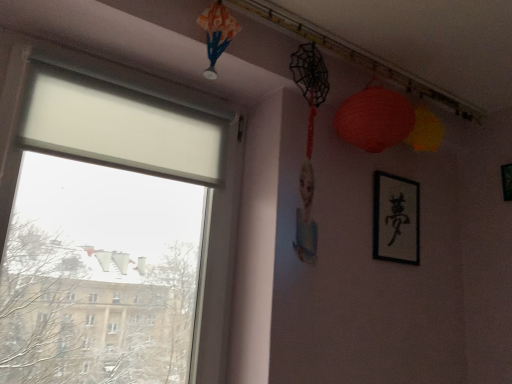
Image resolution: width=512 pixels, height=384 pixels. What do you see at coordinates (506, 181) in the screenshot? I see `black matte picture frame at upper right, the 2th picture frame in the left-to-right sequence` at bounding box center [506, 181].

At what (x,y) coordinates should I click in order to perform the action: click on black matte picture frame at upper right, the 2th picture frame in the left-to-right sequence. Please return your answer as a coordinate pair (x, y). Looking at the image, I should click on (506, 181).

What do you see at coordinates (396, 218) in the screenshot?
I see `black paper at upper right, which is counted as the second picture frame, starting from the right` at bounding box center [396, 218].

This screenshot has height=384, width=512. Find the location of `matte paper lantern at upper right`. matte paper lantern at upper right is located at coordinates (374, 119).

Is black matte picture frame at upper right, the 2th picture frame in the left-to-right sequence, positioned before black paper at upper right, which is counted as the second picture frame, starting from the right?

No, it is behind black paper at upper right, which is counted as the second picture frame, starting from the right.

Considering the sizes of objects black matte picture frame at upper right, the 1th picture frame when ordered from right to left, and black paper at upper right, the first picture frame when ordered from left to right, in the image provided, who is wider, black matte picture frame at upper right, the 1th picture frame when ordered from right to left, or black paper at upper right, the first picture frame when ordered from left to right,?

black paper at upper right, the first picture frame when ordered from left to right.

Is black matte picture frame at upper right, the 1th picture frame when ordered from right to left, shorter than black paper at upper right, which is counted as the second picture frame, starting from the right?

Correct, black matte picture frame at upper right, the 1th picture frame when ordered from right to left, is not as tall as black paper at upper right, which is counted as the second picture frame, starting from the right.

Considering the positions of point (374, 102) and point (397, 215), is point (374, 102) closer or farther from the camera than point (397, 215)?

Point (374, 102) is closer to the camera than point (397, 215).

Which object is closer to the camera, matte paper lantern at upper right or black paper at upper right, the first picture frame when ordered from left to right?

matte paper lantern at upper right is closer to the camera.

From the picture: Is matte paper lantern at upper right beside black paper at upper right, the first picture frame when ordered from left to right?

matte paper lantern at upper right and black paper at upper right, the first picture frame when ordered from left to right, are clearly separated.

Is matte paper lantern at upper right positioned with its back to black paper at upper right, the first picture frame when ordered from left to right?

That's not correct — matte paper lantern at upper right is not looking away from black paper at upper right, the first picture frame when ordered from left to right.

From a real-world perspective, which is physically above, black matte picture frame at upper right, the 2th picture frame in the left-to-right sequence, or matte paper lantern at upper right?

matte paper lantern at upper right is physically above.

Does black matte picture frame at upper right, the 2th picture frame in the left-to-right sequence, have a smaller size compared to matte paper lantern at upper right?

Correct, black matte picture frame at upper right, the 2th picture frame in the left-to-right sequence, occupies less space than matte paper lantern at upper right.

Is black matte picture frame at upper right, the 2th picture frame in the left-to-right sequence, wider or thinner than matte paper lantern at upper right?

Considering their sizes, black matte picture frame at upper right, the 2th picture frame in the left-to-right sequence, looks slimmer than matte paper lantern at upper right.

Consider the image. Are black matte picture frame at upper right, the 1th picture frame when ordered from right to left, and matte paper lantern at upper right far apart?

No.

How far apart are matte paper lantern at upper right and black matte picture frame at upper right, the 2th picture frame in the left-to-right sequence?

matte paper lantern at upper right and black matte picture frame at upper right, the 2th picture frame in the left-to-right sequence, are 27.24 inches apart.

Considering the sizes of objects matte paper lantern at upper right and black matte picture frame at upper right, the 2th picture frame in the left-to-right sequence, in the image provided, who is wider, matte paper lantern at upper right or black matte picture frame at upper right, the 2th picture frame in the left-to-right sequence,?

matte paper lantern at upper right is wider.

Is matte paper lantern at upper right positioned beyond the bounds of black matte picture frame at upper right, the 1th picture frame when ordered from right to left?

Absolutely, matte paper lantern at upper right is external to black matte picture frame at upper right, the 1th picture frame when ordered from right to left.

Is matte paper lantern at upper right bigger than black matte picture frame at upper right, the 1th picture frame when ordered from right to left?

Yes, matte paper lantern at upper right is bigger than black matte picture frame at upper right, the 1th picture frame when ordered from right to left.

From the image's perspective, relative to matte paper lantern at upper right, is black paper at upper right, which is counted as the second picture frame, starting from the right, above or below?

black paper at upper right, which is counted as the second picture frame, starting from the right, is situated lower than matte paper lantern at upper right in the image.

Which of these two, black paper at upper right, the first picture frame when ordered from left to right, or matte paper lantern at upper right, is smaller?

Smaller between the two is black paper at upper right, the first picture frame when ordered from left to right.

Is black paper at upper right, the first picture frame when ordered from left to right, positioned beyond the bounds of matte paper lantern at upper right?

Yes, black paper at upper right, the first picture frame when ordered from left to right, is not within matte paper lantern at upper right.

From a real-world perspective, between black paper at upper right, the first picture frame when ordered from left to right, and matte paper lantern at upper right, who is vertically lower?

From a 3D spatial view, black paper at upper right, the first picture frame when ordered from left to right, is below.

Considering the sizes of black paper at upper right, which is counted as the second picture frame, starting from the right, and black matte picture frame at upper right, the 1th picture frame when ordered from right to left, in the image, is black paper at upper right, which is counted as the second picture frame, starting from the right, wider or thinner than black matte picture frame at upper right, the 1th picture frame when ordered from right to left,?

Clearly, black paper at upper right, which is counted as the second picture frame, starting from the right, has more width compared to black matte picture frame at upper right, the 1th picture frame when ordered from right to left.

Is black paper at upper right, which is counted as the second picture frame, starting from the right, aimed at black matte picture frame at upper right, the 2th picture frame in the left-to-right sequence?

No, black paper at upper right, which is counted as the second picture frame, starting from the right, is not turned towards black matte picture frame at upper right, the 2th picture frame in the left-to-right sequence.

Would you say black matte picture frame at upper right, the 2th picture frame in the left-to-right sequence, is part of black paper at upper right, the first picture frame when ordered from left to right,'s contents?

No.

Find the location of a particular element. This screenshot has width=512, height=384. picture frame lying on the right of black paper at upper right, the first picture frame when ordered from left to right is located at coordinates (506, 181).

Find the location of a particular element. This screenshot has height=384, width=512. lantern positioned vertically above the black paper at upper right, the first picture frame when ordered from left to right (from a real-world perspective) is located at coordinates (374, 119).

Estimate the real-world distances between objects in this image. Which object is closer to black matte picture frame at upper right, the 1th picture frame when ordered from right to left, black paper at upper right, the first picture frame when ordered from left to right, or matte paper lantern at upper right?

black paper at upper right, the first picture frame when ordered from left to right, is closer to black matte picture frame at upper right, the 1th picture frame when ordered from right to left.

From the image, which object appears to be farther from matte paper lantern at upper right, black paper at upper right, which is counted as the second picture frame, starting from the right, or black matte picture frame at upper right, the 2th picture frame in the left-to-right sequence?

black matte picture frame at upper right, the 2th picture frame in the left-to-right sequence, is positioned further to the anchor matte paper lantern at upper right.

From the image, which object appears to be nearer to black paper at upper right, the first picture frame when ordered from left to right, matte paper lantern at upper right or black matte picture frame at upper right, the 2th picture frame in the left-to-right sequence?

Based on the image, matte paper lantern at upper right appears to be nearer to black paper at upper right, the first picture frame when ordered from left to right.

Looking at the image, which one is located closer to black paper at upper right, which is counted as the second picture frame, starting from the right, black matte picture frame at upper right, the 1th picture frame when ordered from right to left, or matte paper lantern at upper right?

matte paper lantern at upper right lies closer to black paper at upper right, which is counted as the second picture frame, starting from the right, than the other object.

Looking at the image, which one is located closer to matte paper lantern at upper right, black matte picture frame at upper right, the 1th picture frame when ordered from right to left, or black paper at upper right, which is counted as the second picture frame, starting from the right?

black paper at upper right, which is counted as the second picture frame, starting from the right, lies closer to matte paper lantern at upper right than the other object.

From the image, which object appears to be nearer to black matte picture frame at upper right, the 2th picture frame in the left-to-right sequence, matte paper lantern at upper right or black paper at upper right, which is counted as the second picture frame, starting from the right?

black paper at upper right, which is counted as the second picture frame, starting from the right, is positioned closer to the anchor black matte picture frame at upper right, the 2th picture frame in the left-to-right sequence.

You are a GUI agent. You are given a task and a screenshot of the screen. Output one action in this format:
    pyautogui.click(x=<x>, y=<y>)
    Task: Click on the picture frame situated between matte paper lantern at upper right and black matte picture frame at upper right, the 1th picture frame when ordered from right to left, from left to right
    
    Given the screenshot: What is the action you would take?
    click(396, 218)